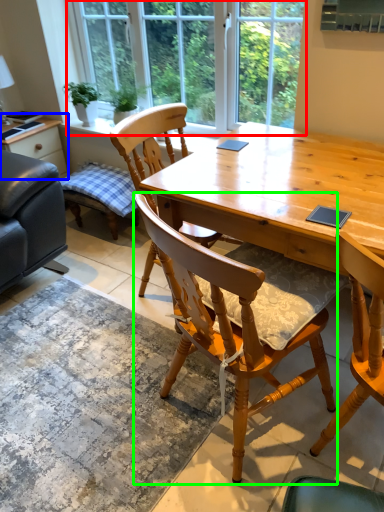
Question: Which object is positioned farthest from window (highlighted by a red box)? Select from table (highlighted by a blue box) and chair (highlighted by a green box).

Choices:
 (A) table
 (B) chair

Answer: (B)